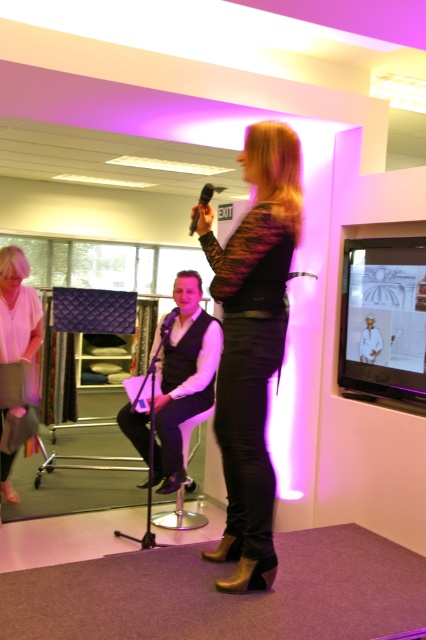
Looking at this image, between matte black vest at center and orange matte microphone at upper center, which one is positioned higher?

Positioned higher is orange matte microphone at upper center.

Does point (138, 416) lie behind point (206, 192)?

Yes, it is behind point (206, 192).

Locate an element on the screen. matte black vest at center is located at coordinates (184, 378).

Which is below, leopard print sweater at center or matte white blouse at center?

leopard print sweater at center is below.

Is leopard print sweater at center positioned before matte white blouse at center?

Yes, leopard print sweater at center is in front of matte white blouse at center.

Who is more distant from viewer, (244,451) or (5,344)?

Point (5,344)

Locate an element on the screen. leopard print sweater at center is located at coordinates (252, 344).

Can you confirm if matte white blouse at center is positioned below black matte microphone at center?

No.

Between matte white blouse at center and black matte microphone at center, which one is positioned higher?

matte white blouse at center is higher up.

Is point (19, 257) in front of point (164, 323)?

Yes, point (19, 257) is closer to viewer.

Find the location of `matte white blouse at center`. matte white blouse at center is located at coordinates (17, 308).